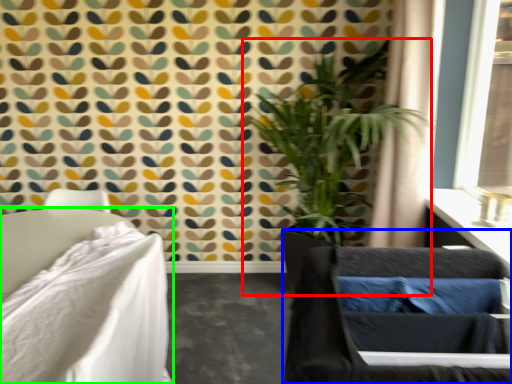
Question: Estimate the real-world distances between objects in this image. Which object is farther from houseplant (highlighted by a red box), swivel chair (highlighted by a blue box) or furniture (highlighted by a green box)?

Choices:
 (A) swivel chair
 (B) furniture

Answer: (A)